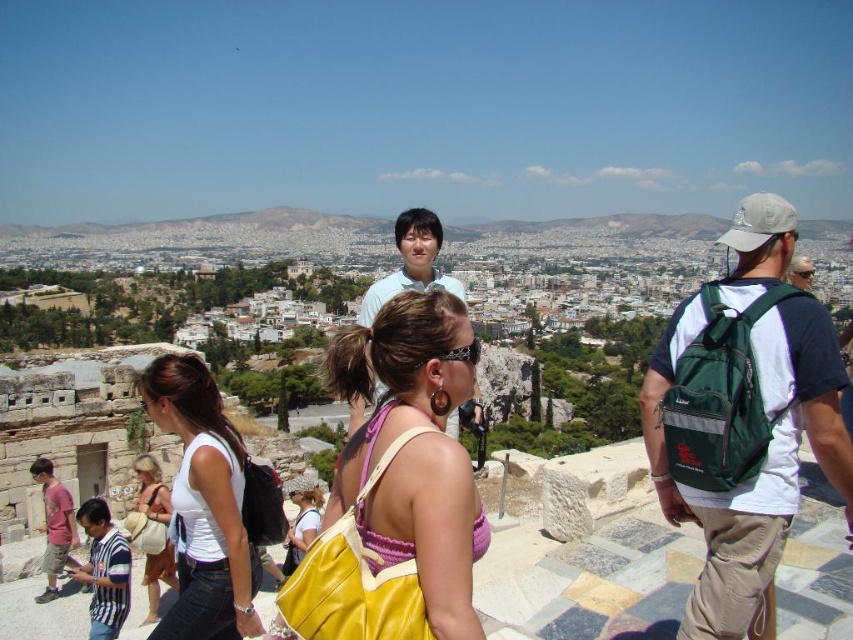
Question: Does white matte tank top at center have a lesser width compared to light blue shirt at center?

Choices:
 (A) no
 (B) yes

Answer: (B)

Question: Which of the following is the closest to the observer?

Choices:
 (A) yellow fabric purse at center
 (B) white matte tank top at center

Answer: (A)

Question: Is green fabric backpack at right in front of yellow fabric purse at center?

Choices:
 (A) no
 (B) yes

Answer: (A)

Question: Which object is the closest to the yellow fabric purse at center?

Choices:
 (A) light blue shirt at center
 (B) white matte tank top at center
 (C) beige fabric purse at center

Answer: (B)

Question: Which point is closer to the camera taking this photo?

Choices:
 (A) (683, 307)
 (B) (370, 292)
 (C) (192, 582)

Answer: (C)

Question: Does yellow fabric purse at center have a greater width compared to light blue shirt at center?

Choices:
 (A) yes
 (B) no

Answer: (B)